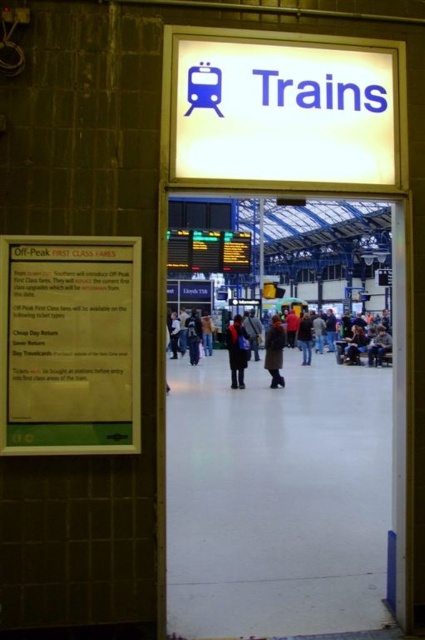
You are standing at the entrance of the train station and want to reach the ticket counter located at point [116,275]. If your walking speed is 1.5 meters per second, how many seconds will it take you to reach the ticket counter?

The distance between you and the ticket counter at point [116,275] is 3.64 meters. At a speed of 1.5 meters per second, it will take approximately 2.43 seconds to reach the ticket counter.

You are holding a dark brown coat at center and want to hang it on a hook located to the right of the green paper sign at left. Can you fit the coat on the hook without moving the sign?

The green paper sign at left might be wider than dark brown coat at center, so it is uncertain if the coat can fit without moving the sign.

You are standing at the entrance of the train station and see a person wearing a dark blue jacket at right and dark blue jeans at center. You need to reach the ticket counter quickly. Which direction should you move towards to get closer to the ticket counter?

The dark blue jacket at right is 2.54 meters away from dark blue jeans at center. Since the ticket counter is likely located further inside the station, you should move towards the dark blue jeans at center to get closer to the ticket counter.